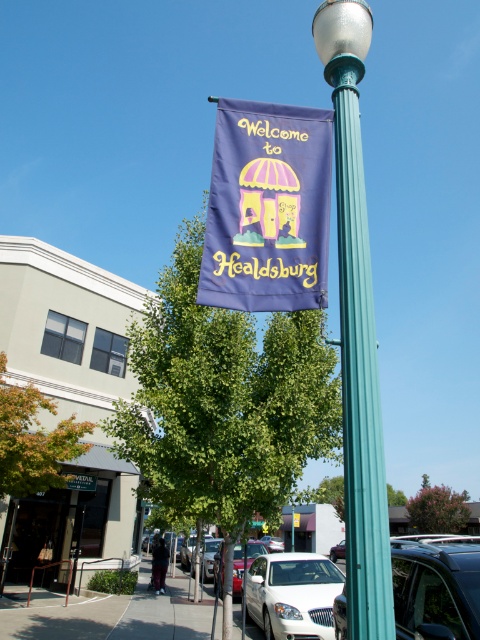
Is green leafy tree at center behind purple fabric banner at upper center?

No, it is not.

Can you confirm if green leafy tree at center is wider than purple fabric banner at upper center?

Yes.

Is point (325, 419) less distant than point (456, 518)?

Yes, point (325, 419) is in front of point (456, 518).

Where is `green leafy tree at center`? The image size is (480, 640). green leafy tree at center is located at coordinates (224, 401).

Does purple fabric banner at center come behind purple fabric banner at upper center?

No, purple fabric banner at center is in front of purple fabric banner at upper center.

Based on the photo, between purple fabric banner at center and purple fabric banner at upper center, which one appears on the left side from the viewer's perspective?

From the viewer's perspective, purple fabric banner at center appears more on the left side.

Is point (326, 221) positioned after point (419, 490)?

That is False.

Where is `purple fabric banner at center`? The height and width of the screenshot is (640, 480). purple fabric banner at center is located at coordinates (267, 208).

I want to click on teal metallic street light at center, so click(357, 330).

Is point (357, 264) less distant than point (43, 474)?

That is True.

Does point (336, 189) lie behind point (32, 465)?

No.

Locate an element on the screen. teal metallic street light at center is located at coordinates (357, 330).